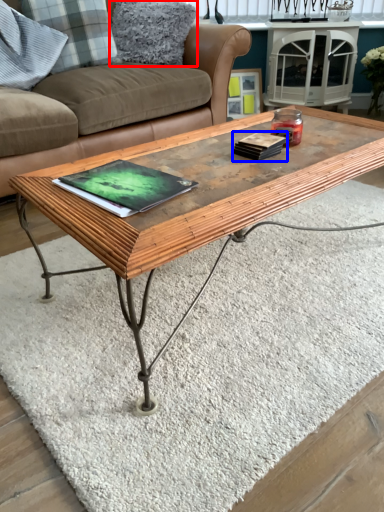
Question: Which of the following is the closest to the observer, pillow (highlighted by a red box) or book (highlighted by a blue box)?

Choices:
 (A) pillow
 (B) book

Answer: (B)